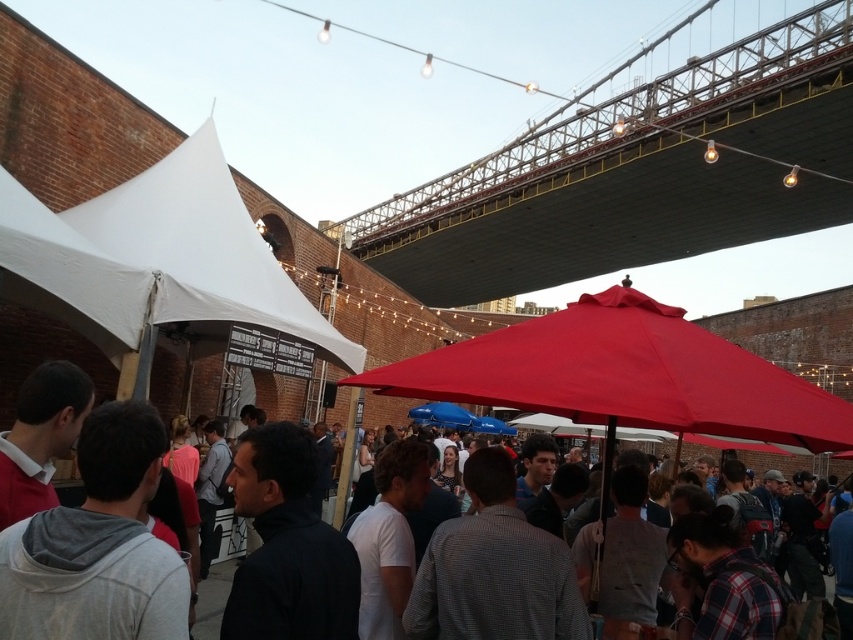
Question: Which of the following is the farthest from the observer?

Choices:
 (A) red matte umbrella at center
 (B) white fabric canopy at left
 (C) metallic gray bridge at upper center
 (D) matte black umbrella at center

Answer: (C)

Question: Is metallic gray bridge at upper center bigger than red matte umbrella at center?

Choices:
 (A) yes
 (B) no

Answer: (A)

Question: Is white fabric canopy at left positioned in front of matte black umbrella at center?

Choices:
 (A) yes
 (B) no

Answer: (B)

Question: Does white fabric canopy at left appear over red matte umbrella at center?

Choices:
 (A) no
 (B) yes

Answer: (B)

Question: Which is farther from the metallic gray bridge at upper center?

Choices:
 (A) red matte umbrella at center
 (B) white fabric canopy at left
 (C) matte black umbrella at center

Answer: (C)

Question: Considering the real-world distances, which object is farthest from the red matte umbrella at center?

Choices:
 (A) metallic gray bridge at upper center
 (B) white fabric canopy at left

Answer: (A)